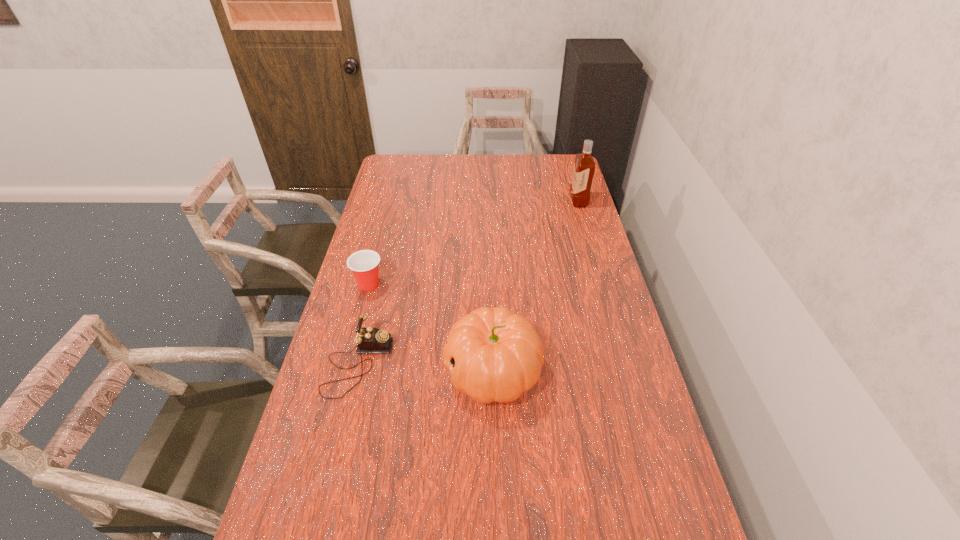
The height and width of the screenshot is (540, 960). Find the location of `the rightmost object`. the rightmost object is located at coordinates (584, 166).

Find the location of a particular element. The image size is (960, 540). liquor is located at coordinates (584, 166).

Find the location of `the second object from right to left`. the second object from right to left is located at coordinates (493, 354).

Identify the location of the second tallest object. (493, 354).

Locate an element on the screen. Image resolution: width=960 pixels, height=540 pixels. the second farthest object is located at coordinates (364, 264).

The width and height of the screenshot is (960, 540). What are the coordinates of `telephone` in the screenshot? It's located at (369, 340).

Where is `vacant region located on the front label of the tallest object`? vacant region located on the front label of the tallest object is located at coordinates (550, 201).

The width and height of the screenshot is (960, 540). I want to click on free region located on the front label of the tallest object, so click(x=554, y=201).

At what (x,y) coordinates should I click in order to perform the action: click on vacant area situated on the front label of the tallest object. Please return your answer as a coordinate pair (x, y). Looking at the image, I should click on (524, 201).

The image size is (960, 540). What are the coordinates of `free location located 0.270m on the carved face of the second object from right to left` in the screenshot? It's located at (351, 370).